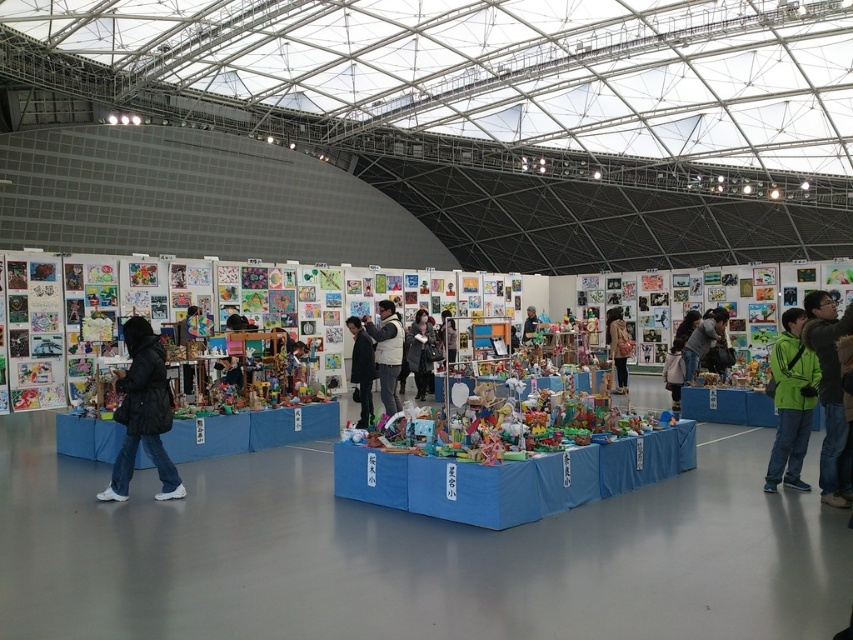
Can you confirm if dark gray jacket at center is wider than black fuzzy jacket at center?

Incorrect, dark gray jacket at center's width does not surpass black fuzzy jacket at center's.

Is dark gray jacket at center thinner than black fuzzy jacket at center?

Indeed, dark gray jacket at center has a lesser width compared to black fuzzy jacket at center.

Is point (372, 410) positioned after point (416, 397)?

No, it is in front of (416, 397).

Locate an element on the screen. The height and width of the screenshot is (640, 853). dark gray jacket at center is located at coordinates (361, 369).

Does black matte jacket at lower left have a greater width compared to green jacket at lower right?

Yes, black matte jacket at lower left is wider than green jacket at lower right.

Image resolution: width=853 pixels, height=640 pixels. What do you see at coordinates (142, 413) in the screenshot? I see `black matte jacket at lower left` at bounding box center [142, 413].

What are the coordinates of `black matte jacket at lower left` in the screenshot? It's located at (142, 413).

Can you confirm if black matte jacket at lower left is positioned to the left of green matte jacket at right?

Yes, black matte jacket at lower left is to the left of green matte jacket at right.

Does black matte jacket at lower left have a greater width compared to green matte jacket at right?

Yes, black matte jacket at lower left is wider than green matte jacket at right.

Is point (114, 381) positioned before point (773, 381)?

No.

Identify the location of black matte jacket at lower left. This screenshot has height=640, width=853. (142, 413).